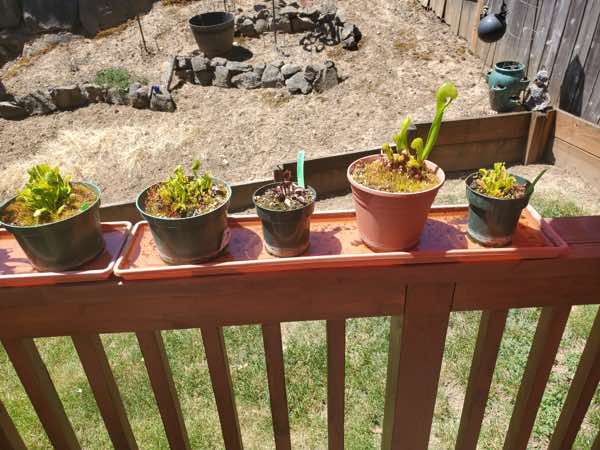
You are a GUI agent. You are given a task and a screenshot of the screen. Output one action in this format:
    pyautogui.click(x=<x>, y=<y>)
    Task: Click on the planter
    
    Given the screenshot: What is the action you would take?
    pyautogui.click(x=496, y=222), pyautogui.click(x=403, y=224), pyautogui.click(x=280, y=235), pyautogui.click(x=204, y=242), pyautogui.click(x=75, y=247), pyautogui.click(x=221, y=35)